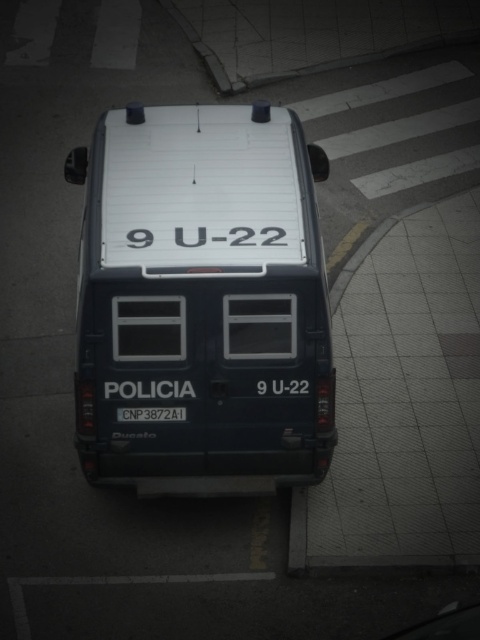
Question: Which point is closer to the camera taking this photo?

Choices:
 (A) (144, 410)
 (B) (180, 488)

Answer: (A)

Question: Is white plastic text at center thinner than white plastic license plate at center?

Choices:
 (A) no
 (B) yes

Answer: (A)

Question: Can you confirm if white plastic text at center is positioned above white plastic license plate at center?

Choices:
 (A) no
 (B) yes

Answer: (B)

Question: Based on their relative distances, which object is nearer to the dark blue matte van at center?

Choices:
 (A) white plastic text at center
 (B) white plastic license plate at center

Answer: (A)

Question: Among these points, which one is farthest from the camera?

Choices:
 (A) (168, 417)
 (B) (132, 234)
 (C) (207, 333)

Answer: (A)

Question: Can you confirm if white plastic text at center is bigger than white plastic license plate at center?

Choices:
 (A) yes
 (B) no

Answer: (A)